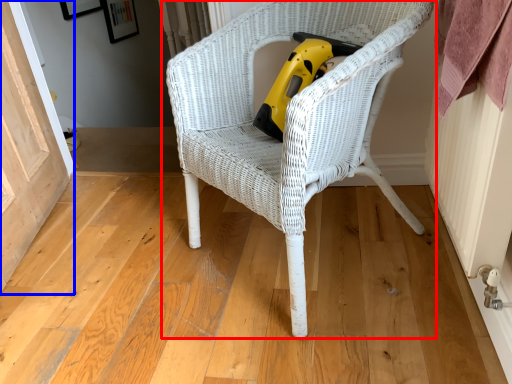
Question: Among these objects, which one is nearest to the camera, chair (highlighted by a red box) or screen door (highlighted by a blue box)?

Choices:
 (A) chair
 (B) screen door

Answer: (A)